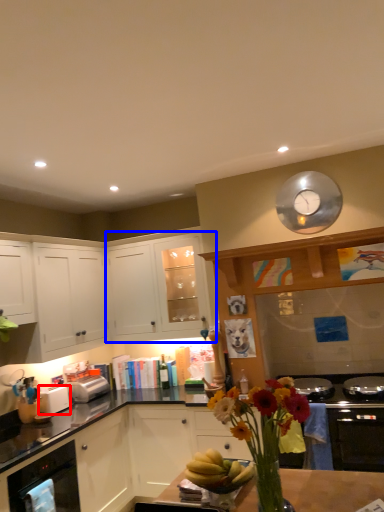
Question: Which object is closer to the camera taking this photo, toaster (highlighted by a red box) or cabinetry (highlighted by a blue box)?

Choices:
 (A) toaster
 (B) cabinetry

Answer: (A)